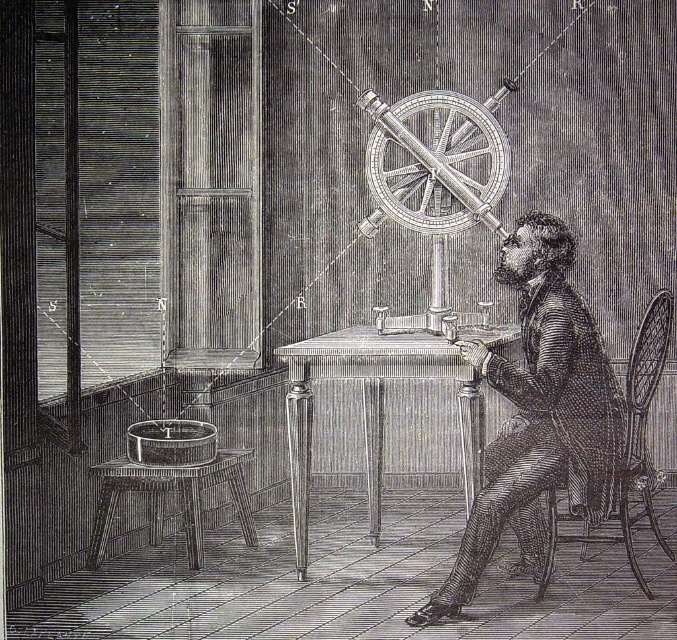
In the scene shown: You are a visitor in the room and want to place a 12 inch wide book on the table. Can you place it between the smooth black coat at center and the wooden table at center?

The smooth black coat at center and wooden table at center are 16.59 inches apart, so yes, the 12 inch wide book can fit between them.

You are standing in front of the engraving and want to know how far the wooden table at center is from you. Can you determine the distance?

The wooden table at center is 4.05 meters away from the camera, so it is 4.05 meters away from you.